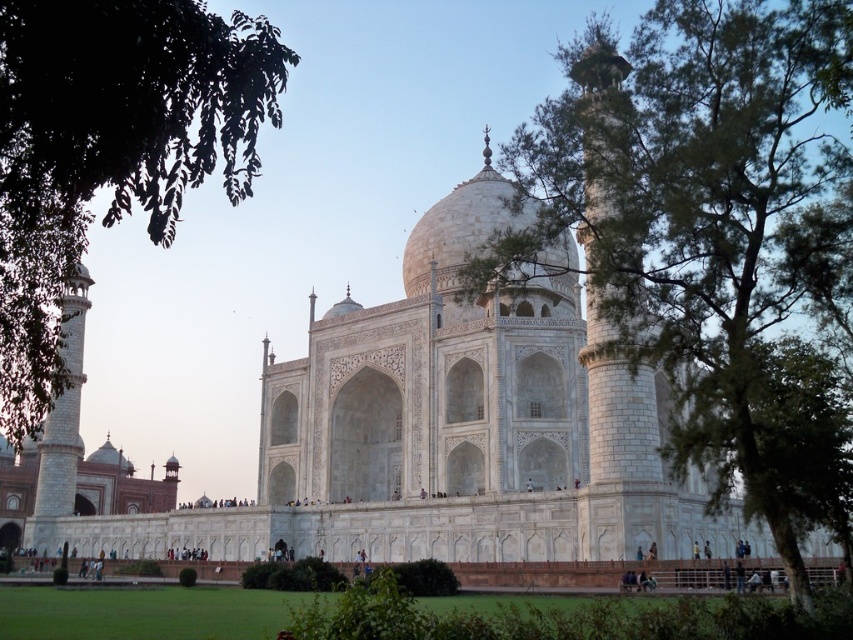
Between green leafy tree at center and green leafy tree at upper left, which one has more height?

green leafy tree at center

The image size is (853, 640). Identify the location of green leafy tree at center. (706, 234).